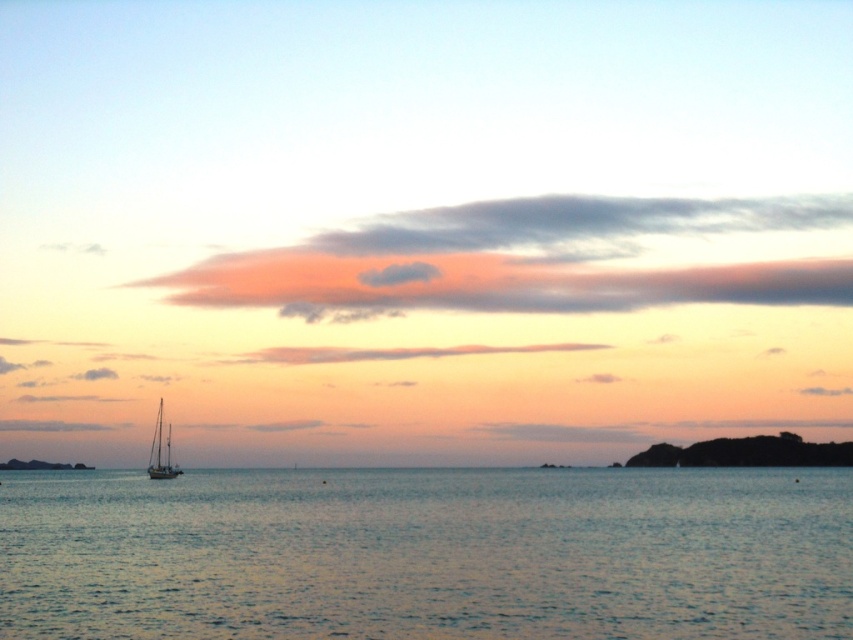
Question: Which point appears farthest from the camera in this image?

Choices:
 (A) pyautogui.click(x=154, y=445)
 (B) pyautogui.click(x=534, y=620)

Answer: (A)

Question: Can you confirm if blue water at center is smaller than white matte sailboat at lower left?

Choices:
 (A) yes
 (B) no

Answer: (B)

Question: Can you confirm if blue water at center is wider than white matte sailboat at lower left?

Choices:
 (A) no
 (B) yes

Answer: (B)

Question: In this image, where is blue water at center located relative to white matte sailboat at lower left?

Choices:
 (A) below
 (B) above

Answer: (B)